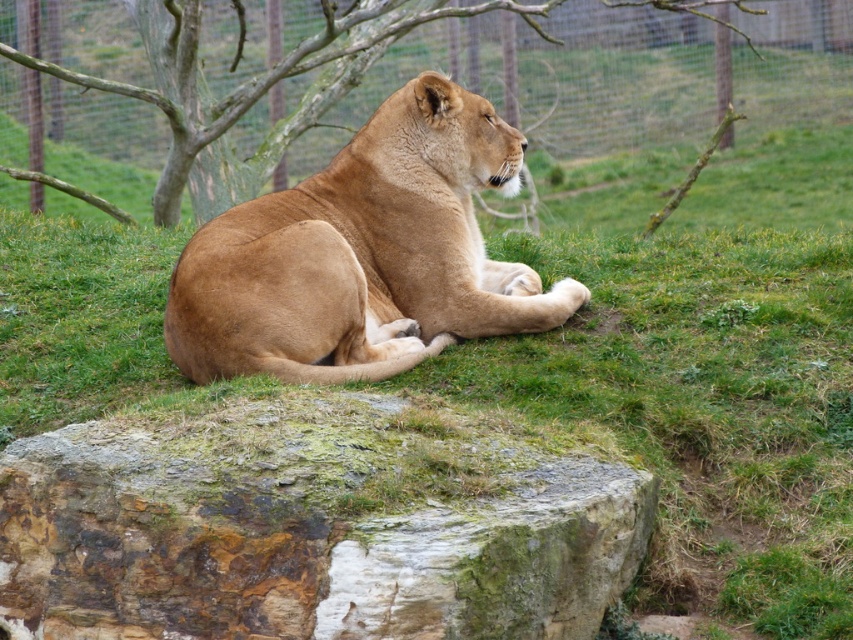
Question: Does golden fur lion at center lie behind brown bark tree at upper center?

Choices:
 (A) yes
 (B) no

Answer: (B)

Question: Does green mossy rock at lower center appear on the left side of golden fur lion at center?

Choices:
 (A) yes
 (B) no

Answer: (A)

Question: Which point appears closest to the camera in this image?

Choices:
 (A) tap(184, 56)
 (B) tap(212, 307)

Answer: (B)

Question: Which object is the farthest from the brown bark tree at upper center?

Choices:
 (A) green mossy rock at lower center
 (B) golden fur lion at center

Answer: (A)

Question: Which object is closer to the camera taking this photo?

Choices:
 (A) green mossy rock at lower center
 (B) brown bark tree at upper center
 (C) golden fur lion at center

Answer: (A)

Question: Can you confirm if golden fur lion at center is positioned above brown bark tree at upper center?

Choices:
 (A) yes
 (B) no

Answer: (B)